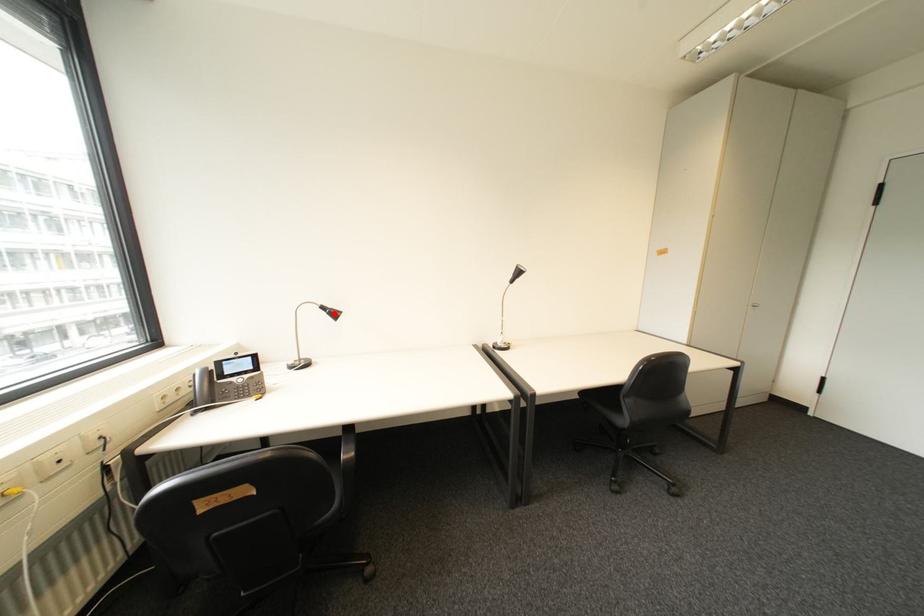
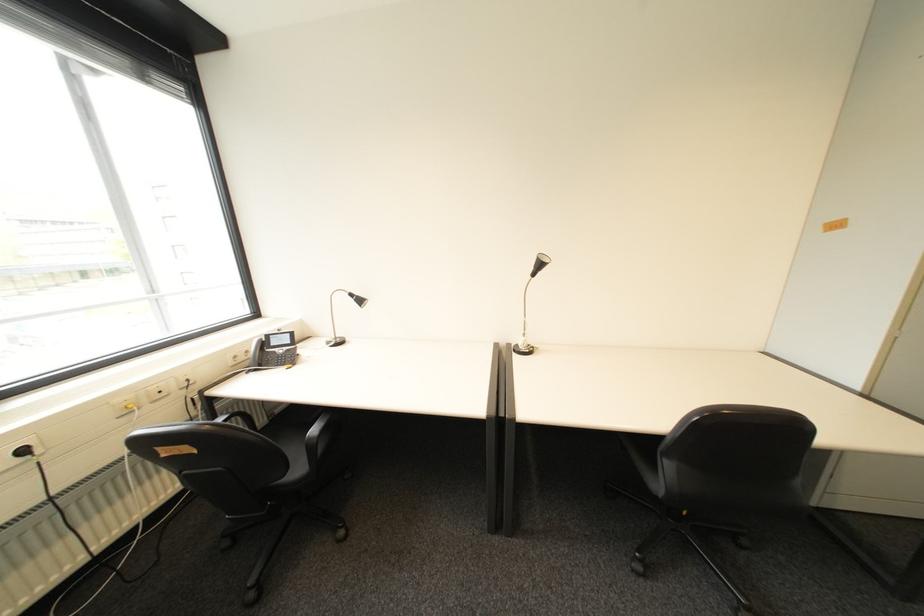
In the second image, find the point that corresponds to the highlighted location in the first image.

(362, 301)